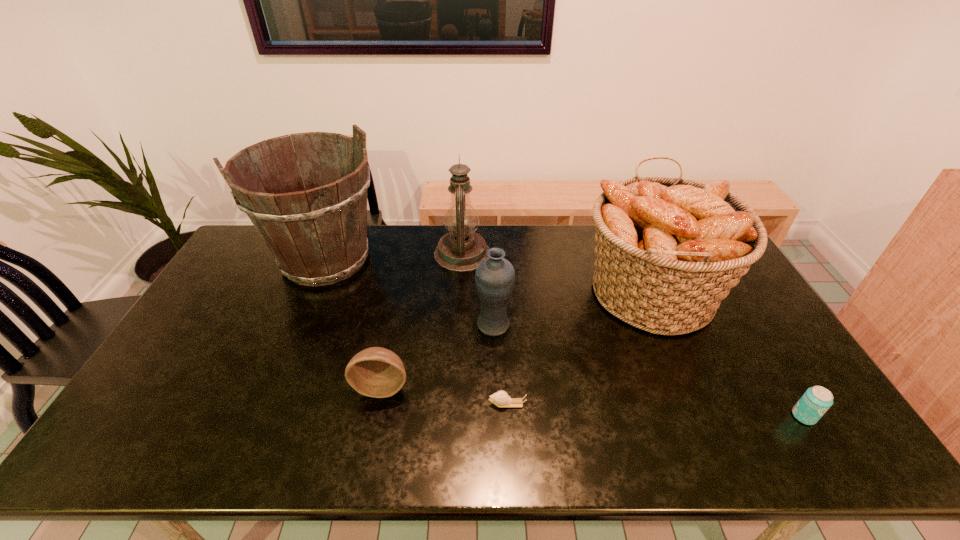
Where is `object at the left edge`? The image size is (960, 540). object at the left edge is located at coordinates (318, 236).

You are a GUI agent. You are given a task and a screenshot of the screen. Output one action in this format:
    pyautogui.click(x=<x>, y=<y>)
    Task: Click on the basket that is at the right edge
    This screenshot has height=540, width=960.
    Given the screenshot: What is the action you would take?
    pyautogui.click(x=668, y=250)

I want to click on beer can that is at the right edge, so click(x=814, y=403).

Locate an element on the screen. object situated at the far left corner is located at coordinates (318, 236).

At what (x,y) coordinates should I click in order to perform the action: click on object that is at the far right corner. Please return your answer as a coordinate pair (x, y). This screenshot has width=960, height=540. Looking at the image, I should click on (668, 250).

Locate an element on the screen. Image resolution: width=960 pixels, height=540 pixels. vacant space at the far edge of the desktop is located at coordinates (583, 231).

Where is `free location at the left edge of the desktop`? free location at the left edge of the desktop is located at coordinates (239, 266).

Where is `free space at the right edge of the desktop`? free space at the right edge of the desktop is located at coordinates (768, 326).

Identify the location of vacant space at the near right corner of the desktop. (781, 437).

I want to click on unoccupied position between the fourth tallest object and the bucket, so click(410, 292).